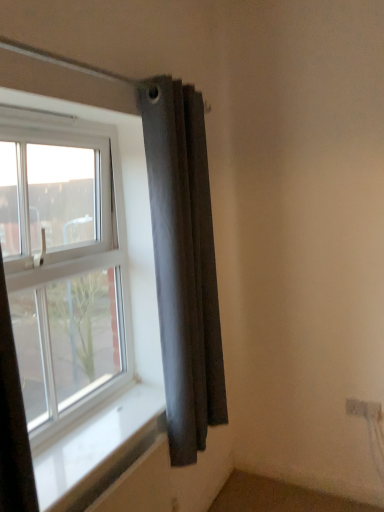
Question: Is dark gray fabric curtain at upper right positioned far away from white plastic window at upper left?

Choices:
 (A) yes
 (B) no

Answer: (B)

Question: Is dark gray fabric curtain at upper right surrounding white plastic window at upper left?

Choices:
 (A) no
 (B) yes

Answer: (A)

Question: From a real-world perspective, is dark gray fabric curtain at upper right on top of white plastic window at upper left?

Choices:
 (A) no
 (B) yes

Answer: (A)

Question: Can you confirm if dark gray fabric curtain at upper right is smaller than white plastic window at upper left?

Choices:
 (A) no
 (B) yes

Answer: (A)

Question: Is the depth of dark gray fabric curtain at upper right greater than that of white plastic window at upper left?

Choices:
 (A) yes
 (B) no

Answer: (A)

Question: Does dark gray fabric curtain at upper right have a lesser width compared to white plastic window at upper left?

Choices:
 (A) yes
 (B) no

Answer: (B)

Question: Does white plastic window at upper left have a smaller size compared to white smooth window sill at lower left?

Choices:
 (A) yes
 (B) no

Answer: (B)

Question: From the image's perspective, is white plastic window at upper left located beneath white smooth window sill at lower left?

Choices:
 (A) yes
 (B) no

Answer: (B)

Question: From a real-world perspective, is white plastic window at upper left positioned under white smooth window sill at lower left based on gravity?

Choices:
 (A) no
 (B) yes

Answer: (A)

Question: Considering the relative sizes of white plastic window at upper left and white smooth window sill at lower left in the image provided, is white plastic window at upper left shorter than white smooth window sill at lower left?

Choices:
 (A) yes
 (B) no

Answer: (B)

Question: Can you confirm if white plastic window at upper left is taller than white smooth window sill at lower left?

Choices:
 (A) yes
 (B) no

Answer: (A)

Question: Does white plastic window at upper left come behind white smooth window sill at lower left?

Choices:
 (A) yes
 (B) no

Answer: (A)

Question: Can you confirm if white smooth window sill at lower left is shorter than dark gray fabric curtain at upper right?

Choices:
 (A) no
 (B) yes

Answer: (B)